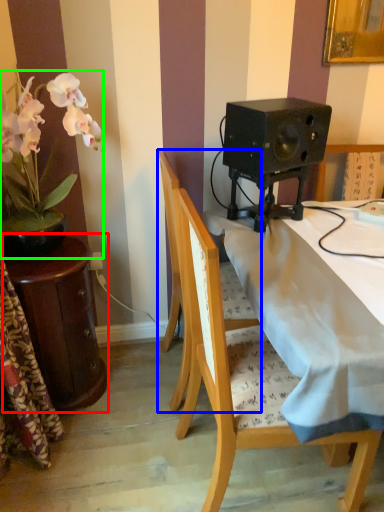
Question: Which is farther away from table (highlighted by a red box)? chair (highlighted by a blue box) or houseplant (highlighted by a green box)?

Choices:
 (A) chair
 (B) houseplant

Answer: (A)